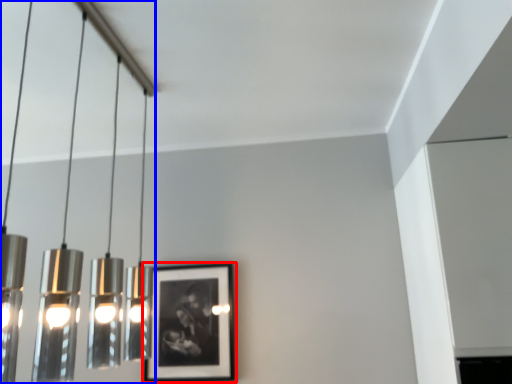
Question: Which object is closer to the camera taking this photo, picture frame (highlighted by a red box) or lamp (highlighted by a blue box)?

Choices:
 (A) picture frame
 (B) lamp

Answer: (B)